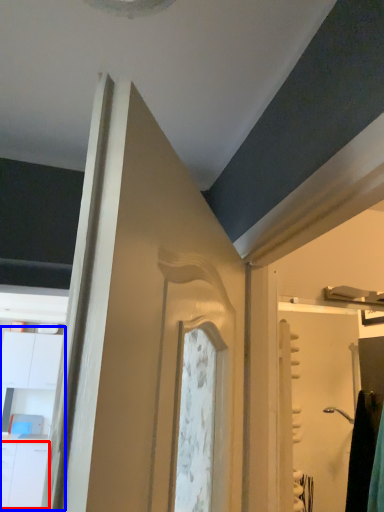
Question: Which point is closer to the camera, drawer (highlighted by a red box) or dresser (highlighted by a blue box)?

Choices:
 (A) drawer
 (B) dresser

Answer: (A)